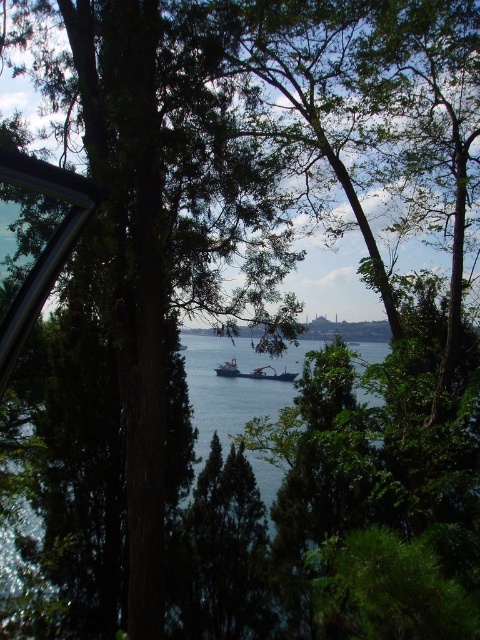
Question: Is the position of metallic blue ship at center more distant than that of metallic gray ship at center?

Choices:
 (A) no
 (B) yes

Answer: (A)

Question: Which point is farther from the camera taking this photo?

Choices:
 (A) (217, 372)
 (B) (235, 372)

Answer: (A)

Question: Is metallic blue ship at center above metallic gray ship at center?

Choices:
 (A) yes
 (B) no

Answer: (B)

Question: Is metallic blue ship at center above metallic gray ship at center?

Choices:
 (A) no
 (B) yes

Answer: (A)

Question: Which object appears farthest from the camera in this image?

Choices:
 (A) metallic blue ship at center
 (B) metallic gray ship at center

Answer: (B)

Question: Which object is farther from the camera taking this photo?

Choices:
 (A) metallic blue ship at center
 (B) metallic gray ship at center

Answer: (B)